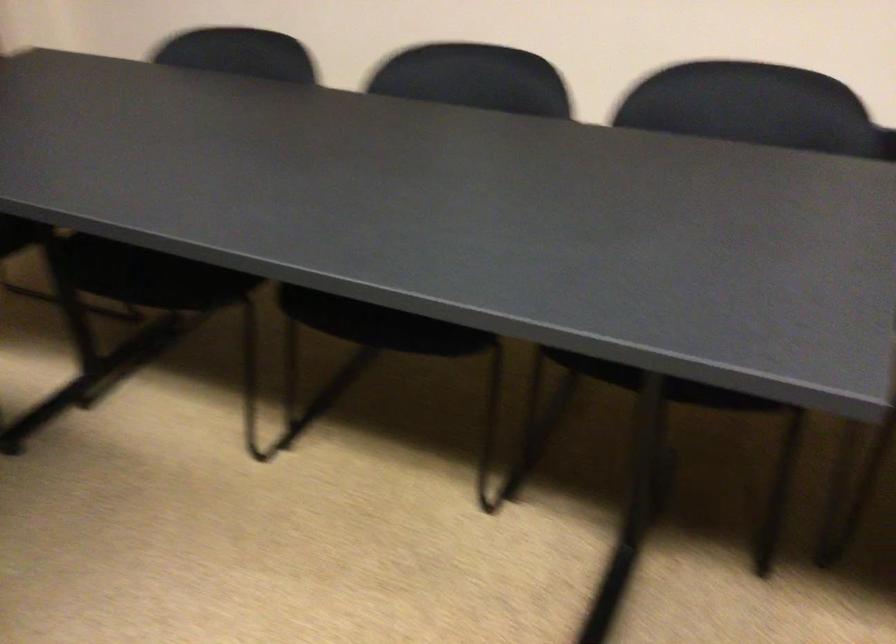
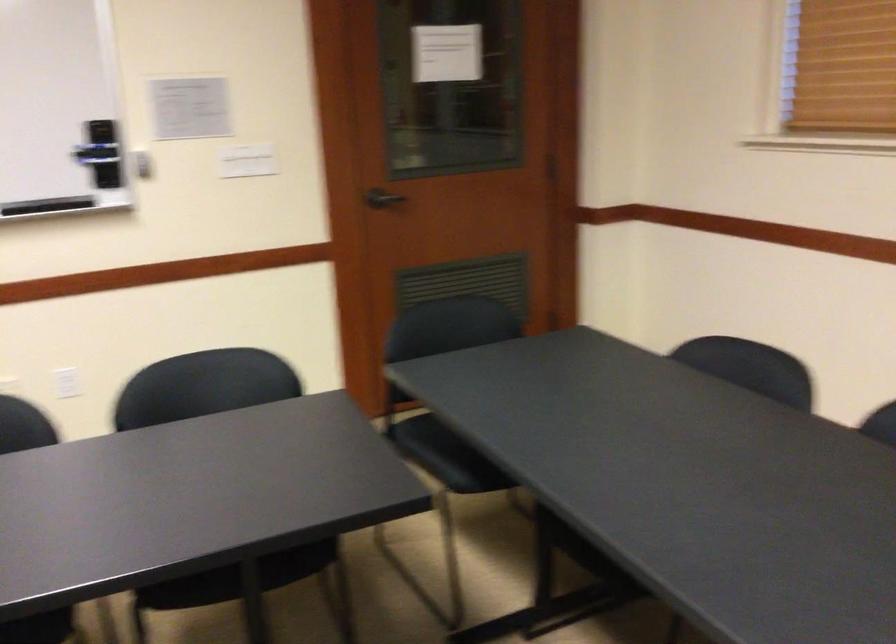
Question: The camera is either moving clockwise (left) or counter-clockwise (right) around the object. The first image is from the beginning of the video and the second image is from the end. Is the camera moving left or right when shooting the video?

Choices:
 (A) Left
 (B) Right

Answer: (B)